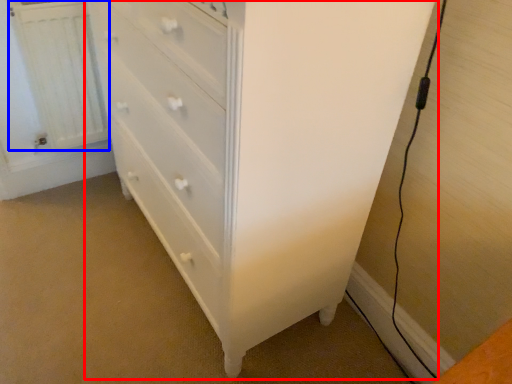
Question: Which of the following is the farthest to the observer, chest of drawers (highlighted by a red box) or radiator (highlighted by a blue box)?

Choices:
 (A) chest of drawers
 (B) radiator

Answer: (B)